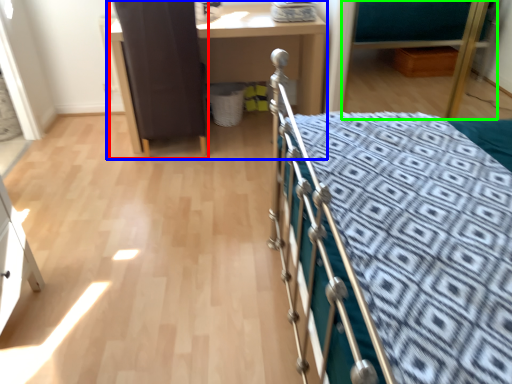
Question: Which is nearer to the screen door (highlighted by a red box)? desk (highlighted by a blue box) or hospital bed (highlighted by a green box).

Choices:
 (A) desk
 (B) hospital bed

Answer: (A)